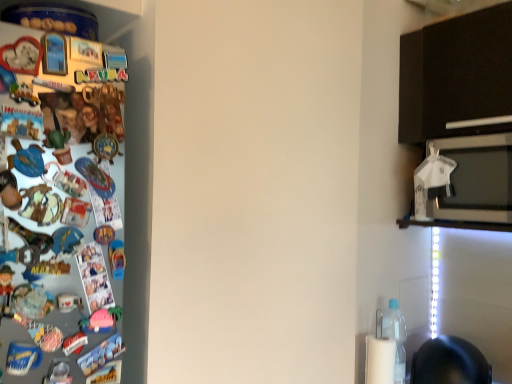
Question: Is clear plastic bottle at lower right wider or thinner than white glossy microwave oven at upper right?

Choices:
 (A) thin
 (B) wide

Answer: (A)

Question: Visually, is clear plastic bottle at lower right positioned to the left or to the right of white glossy microwave oven at upper right?

Choices:
 (A) left
 (B) right

Answer: (A)

Question: Which is nearer to the white plastic umbrella at upper right?

Choices:
 (A) clear plastic bottle at lower right
 (B) white glossy microwave oven at upper right

Answer: (B)

Question: Which object is positioned closest to the white glossy microwave oven at upper right?

Choices:
 (A) white plastic umbrella at upper right
 (B) clear plastic bottle at lower right

Answer: (A)